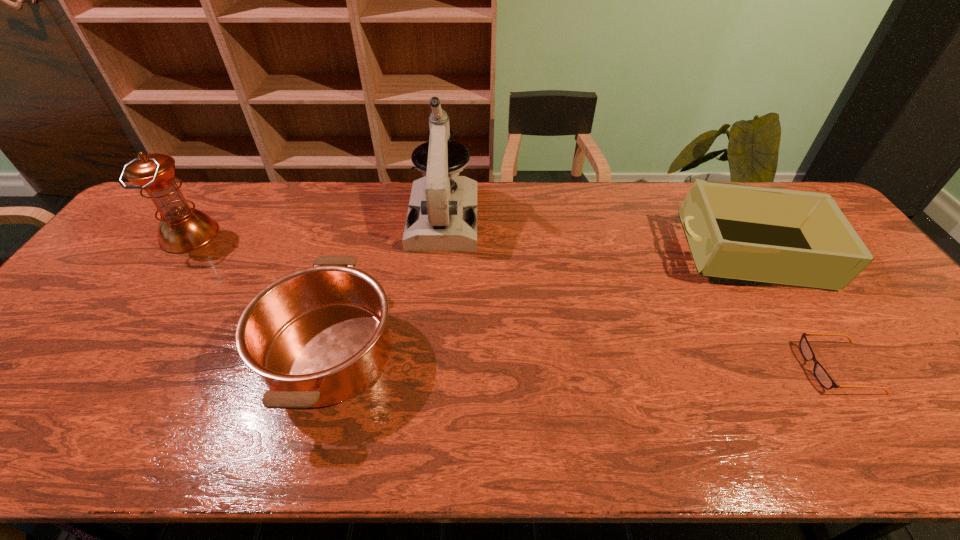
This screenshot has width=960, height=540. In order to click on free space located 0.250m on the front-facing side of the shortest object in this screenshot , I will do `click(700, 368)`.

This screenshot has height=540, width=960. I want to click on free space located 0.190m on the front-facing side of the shortest object, so click(726, 368).

At what (x,y) coordinates should I click in order to perform the action: click on free spot located 0.170m on the front-facing side of the shortest object. Please return your answer as a coordinate pair (x, y). The width and height of the screenshot is (960, 540). Looking at the image, I should click on point(734,368).

In order to click on microscope present at the far edge in this screenshot , I will do `click(442, 215)`.

Image resolution: width=960 pixels, height=540 pixels. Identify the location of oil lamp at the far edge. (182, 229).

You are a GUI agent. You are given a task and a screenshot of the screen. Output one action in this format:
    pyautogui.click(x=<x>, y=<y>)
    Task: Click on the box that is at the far edge
    
    Given the screenshot: What is the action you would take?
    click(x=785, y=237)

Image resolution: width=960 pixels, height=540 pixels. I want to click on object present at the near edge, so tap(318, 336).

Locate an element on the screen. The width and height of the screenshot is (960, 540). object that is at the left edge is located at coordinates (182, 229).

Locate an element on the screen. This screenshot has width=960, height=540. object at the right edge is located at coordinates (785, 237).

Locate an element on the screen. The image size is (960, 540). object present at the far left corner is located at coordinates (182, 229).